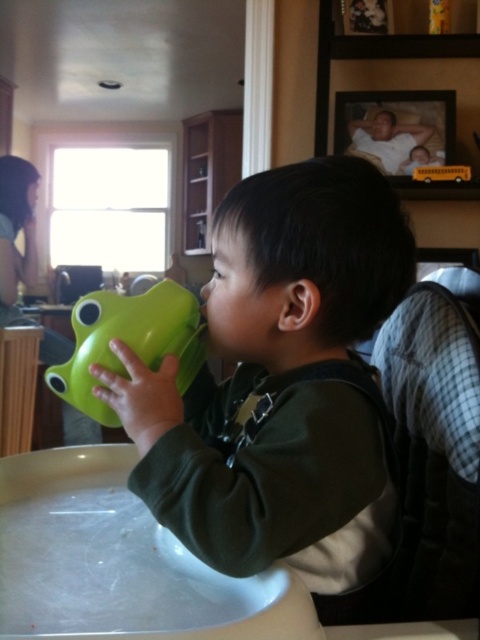
Question: Is green rubber cup at center bigger than green rubber duck at center?

Choices:
 (A) yes
 (B) no

Answer: (A)

Question: Is green rubber cup at center below green rubber duck at center?

Choices:
 (A) no
 (B) yes

Answer: (B)

Question: Can you confirm if green rubber cup at center is positioned to the left of green rubber duck at center?

Choices:
 (A) yes
 (B) no

Answer: (B)